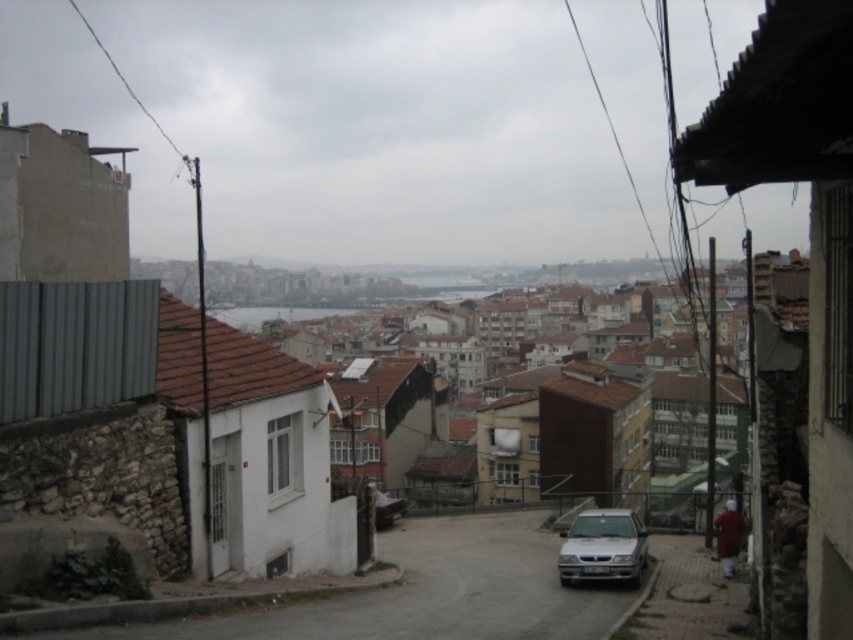
Who is positioned more to the left, silver metallic car at lower center or metallic silver car at center?

metallic silver car at center

Looking at this image, does silver metallic car at lower center appear over metallic silver car at center?

Correct, silver metallic car at lower center is located above metallic silver car at center.

The width and height of the screenshot is (853, 640). Describe the element at coordinates (602, 547) in the screenshot. I see `silver metallic car at lower center` at that location.

Identify the location of silver metallic car at lower center. (602, 547).